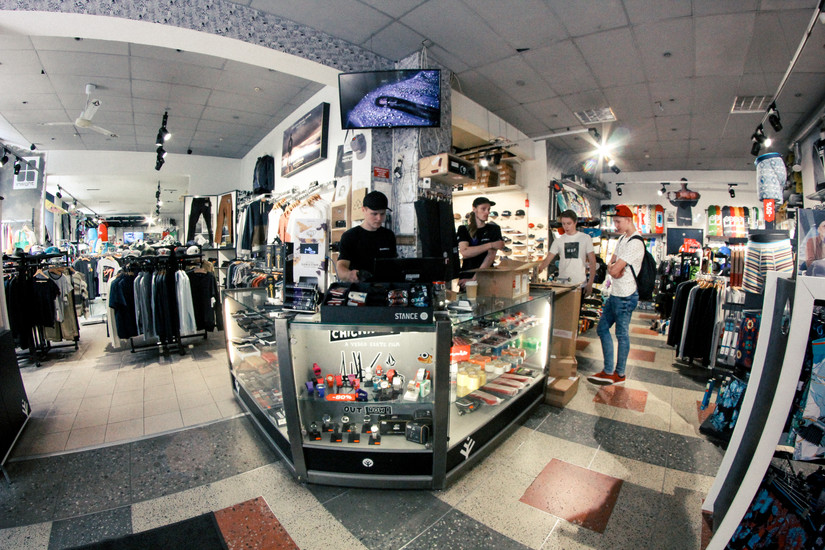
Image resolution: width=825 pixels, height=550 pixels. I want to click on shoes display wall, so click(x=508, y=201).